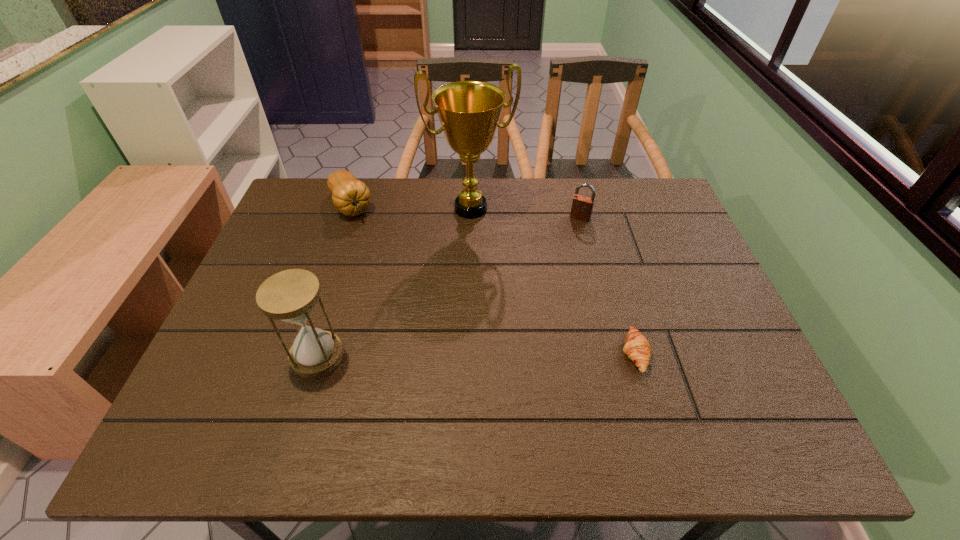
Find the location of a particular element. This screenshot has width=960, height=540. free spot located 0.180m on the front-facing side of the padlock is located at coordinates (559, 260).

At what (x,y) coordinates should I click in order to perform the action: click on free location located on the front-facing side of the padlock. Please return your answer as a coordinate pair (x, y). This screenshot has width=960, height=540. Looking at the image, I should click on (566, 245).

Locate an element on the screen. This screenshot has height=540, width=960. free spot located on the front-facing side of the padlock is located at coordinates (566, 245).

Find the location of a particular element. Image resolution: width=960 pixels, height=540 pixels. free spot located on the stem side of the gourd is located at coordinates point(408,308).

You are a GUI agent. You are given a task and a screenshot of the screen. Output one action in this format:
    pyautogui.click(x=<x>, y=<y>)
    Task: Click on the vacant space situated on the stem side of the gourd
    
    Given the screenshot: What is the action you would take?
    pyautogui.click(x=390, y=278)

Find the location of a particular element. Image resolution: width=960 pixels, height=540 pixels. vacant space located 0.330m on the stem side of the gourd is located at coordinates (400, 295).

I want to click on vacant space located 0.260m on the front view with handles of the award, so click(500, 292).

Find the location of `free space located 0.200m on the front view with handles of the award`. free space located 0.200m on the front view with handles of the award is located at coordinates (494, 275).

Where is `free space located 0.130m on the front view with handles of the award`? This screenshot has width=960, height=540. free space located 0.130m on the front view with handles of the award is located at coordinates (489, 258).

You are a GUI agent. You are given a task and a screenshot of the screen. Output one action in this format:
    pyautogui.click(x=<x>, y=<y>)
    Task: Click on the padlock that is at the far edge
    The width and height of the screenshot is (960, 540).
    Given the screenshot: What is the action you would take?
    pyautogui.click(x=582, y=206)